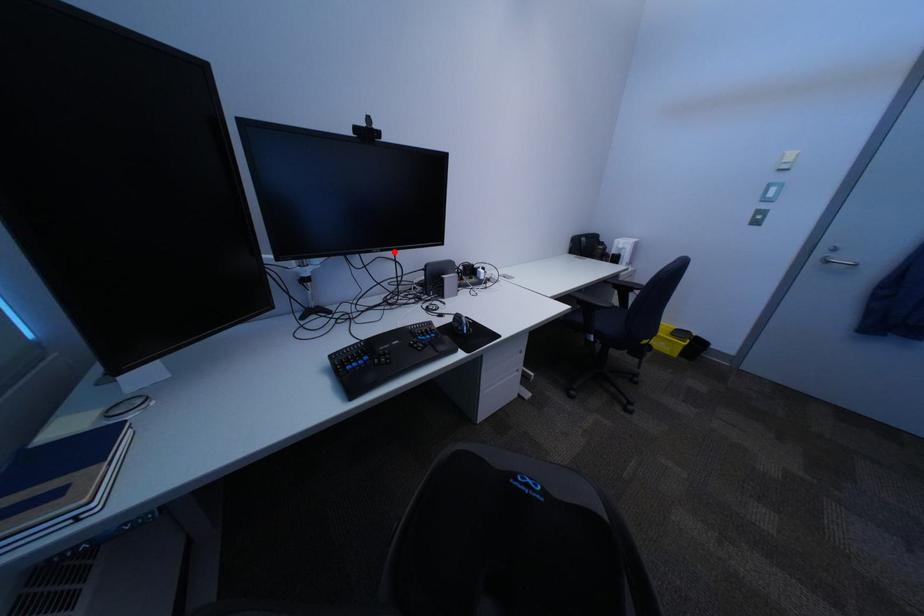
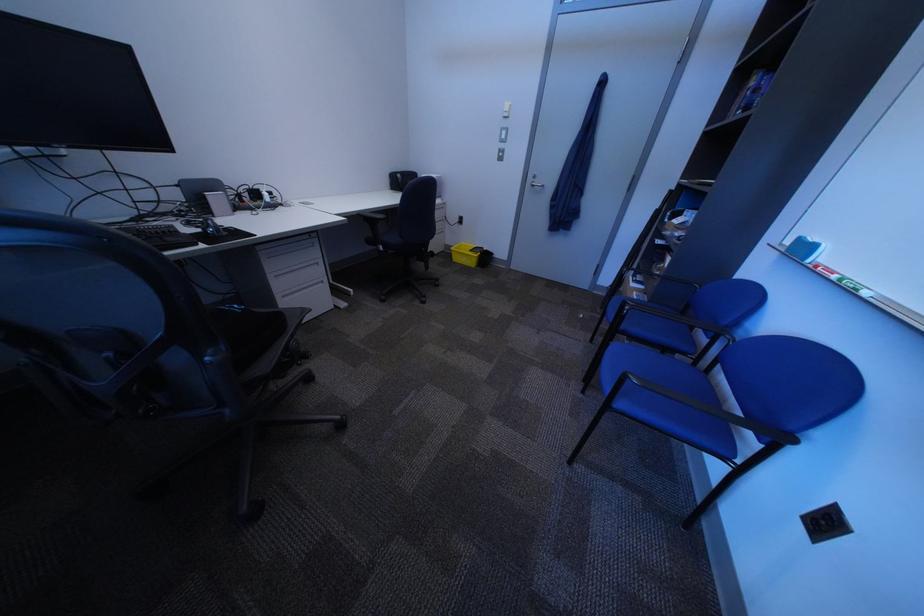
Question: I am providing you with two images of the same scene from different viewpoints. Given a red point in image1, look at the same physical point in image2. Is it:

Choices:
 (A) Closer to the viewpoint
 (B) Farther from the viewpoint

Answer: (B)